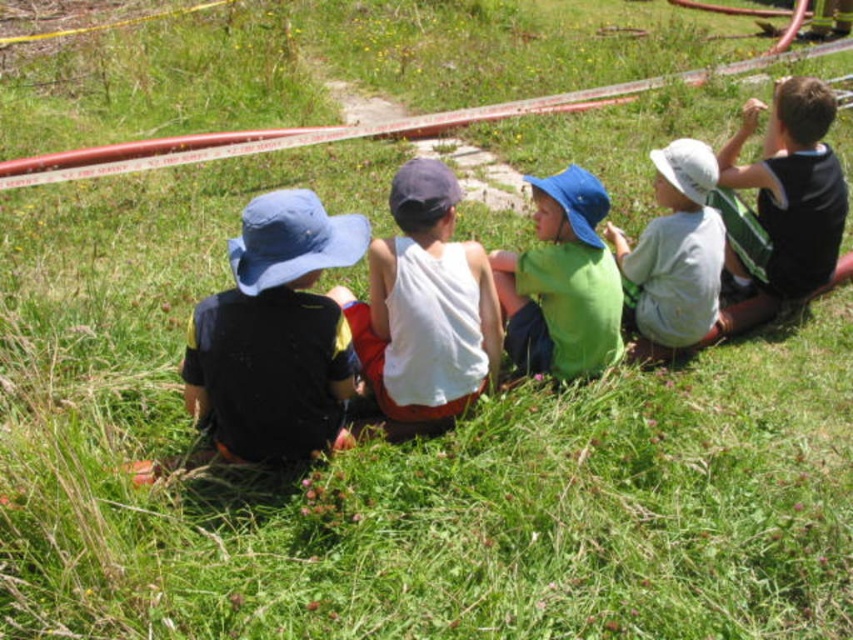
Question: Which point is closer to the camera?

Choices:
 (A) matte blue hat at left
 (B) black jersey at upper right
 (C) green matte shirt at center

Answer: (A)

Question: Which of these objects is positioned farthest from the white cotton tank top at center?

Choices:
 (A) green matte shirt at center
 (B) white cotton shirt at center
 (C) matte blue hat at left

Answer: (B)

Question: Which point is farther to the camera?

Choices:
 (A) black jersey at upper right
 (B) green matte shirt at center
 (C) white cotton tank top at center
 (D) matte blue hat at left

Answer: (A)

Question: Is matte blue hat at left above black jersey at upper right?

Choices:
 (A) no
 (B) yes

Answer: (A)

Question: Is white cotton tank top at center further to the viewer compared to black jersey at upper right?

Choices:
 (A) no
 (B) yes

Answer: (A)

Question: Considering the relative positions of green matte shirt at center and white cotton shirt at center in the image provided, where is green matte shirt at center located with respect to white cotton shirt at center?

Choices:
 (A) above
 (B) below

Answer: (B)